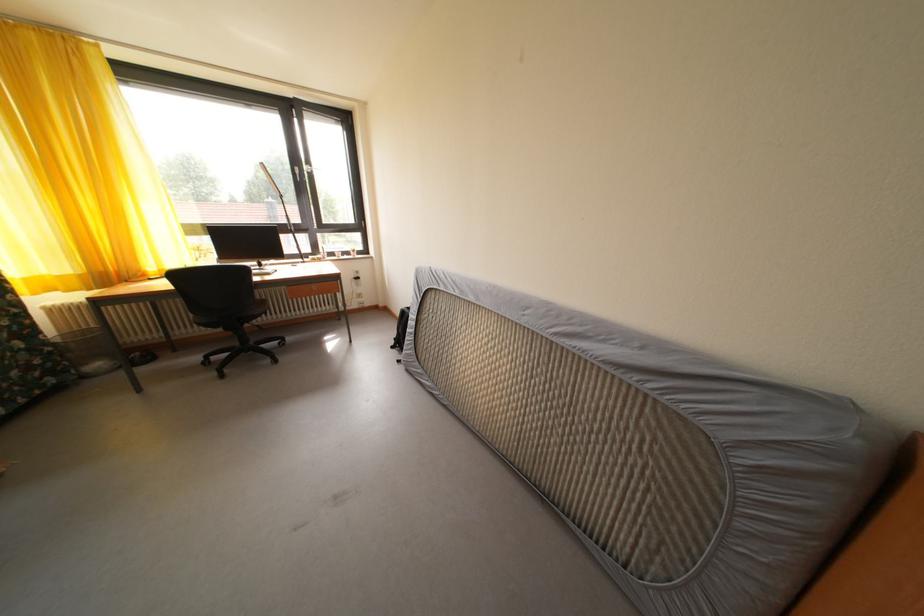
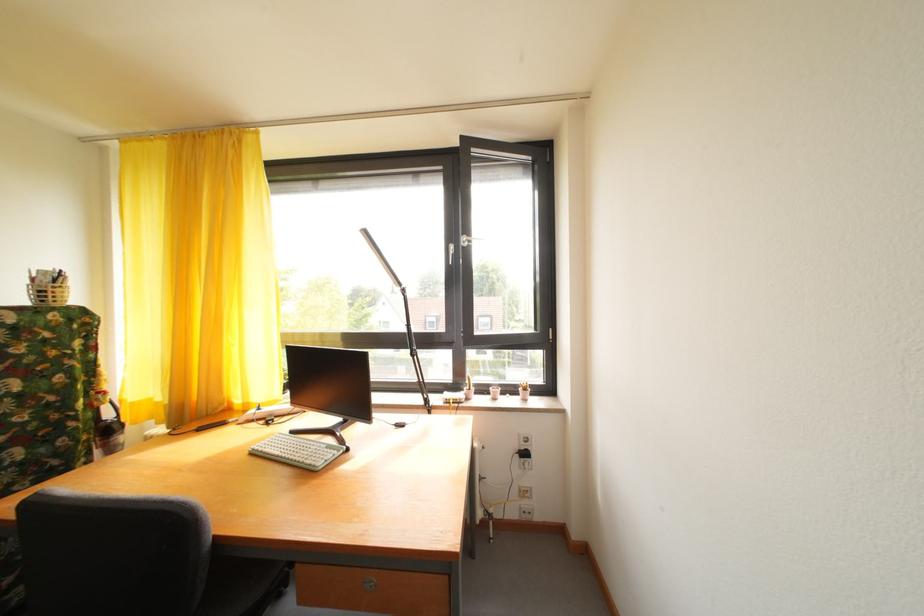
The point at [356,259] is marked in the first image. Where is the corresponding point in the second image?

(520, 395)